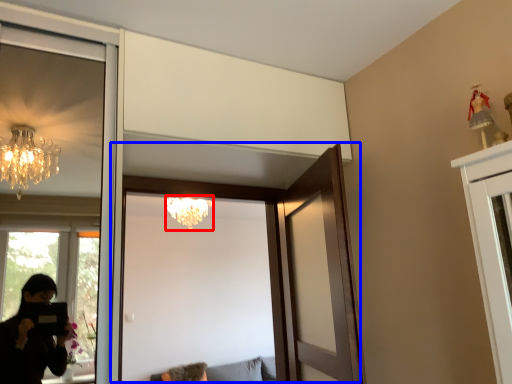
Question: Which object is closer to the camera taking this photo, lamp (highlighted by a red box) or door (highlighted by a blue box)?

Choices:
 (A) lamp
 (B) door

Answer: (B)